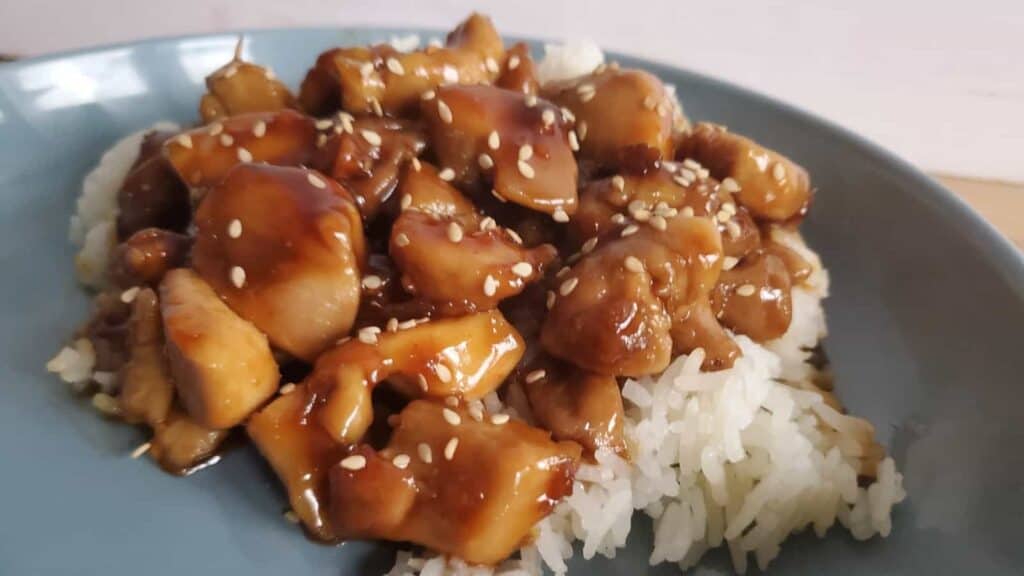
The width and height of the screenshot is (1024, 576). In order to click on blue plate in this screenshot , I will do `click(57, 494)`.